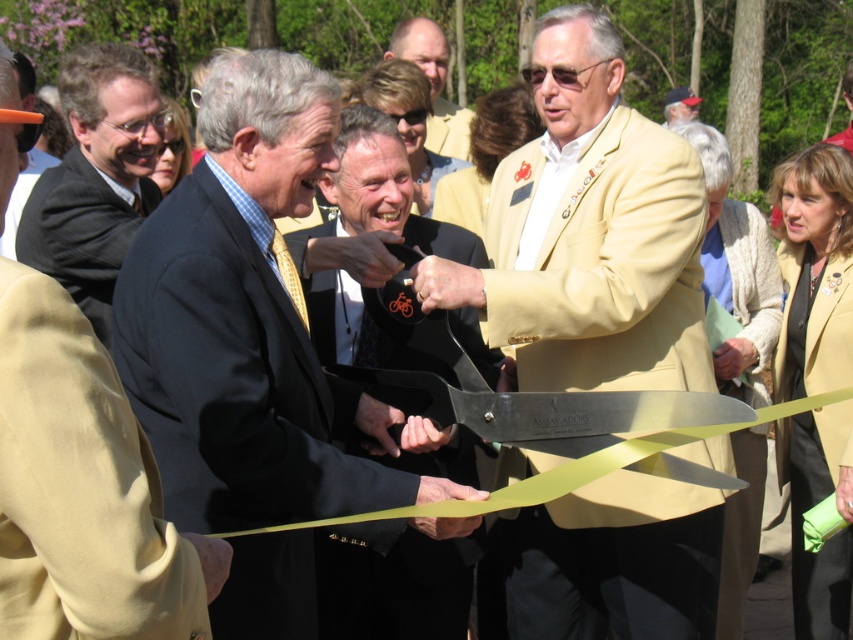
You are a photographer at the ceremony and want to frame both the matte black suit at center and the dark gray suit at left in your shot. Which suit takes up more horizontal space in the photo?

The matte black suit at center takes up more horizontal space in the photo because its width is larger than that of the dark gray suit at left.

You are attending a ribbon cutting ceremony and want to take a photo of the two men in suits. The matte gold suit at center and the dark gray suit at left are both in the frame. Based on their positions, which one is closer to the camera?

The matte gold suit at center is below the dark gray suit at left, so the dark gray suit at left is closer to the camera.

You are a photographer at the ceremony and need to frame both the matte gold suit at center and the matte yellow jacket at center in your shot. Which of the two requires a wider frame to fully capture its width?

The matte gold suit at center requires a wider frame because its width surpasses that of the matte yellow jacket at center.